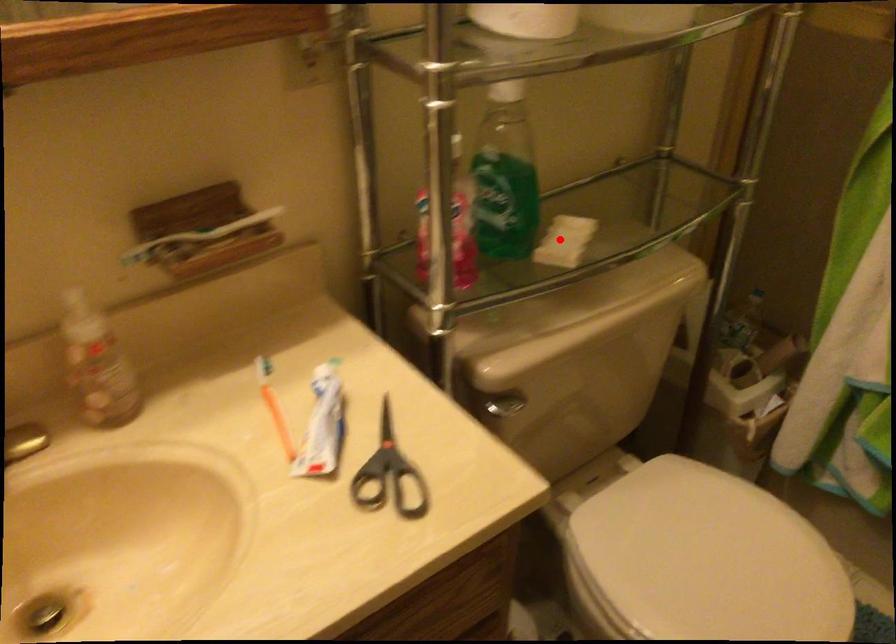
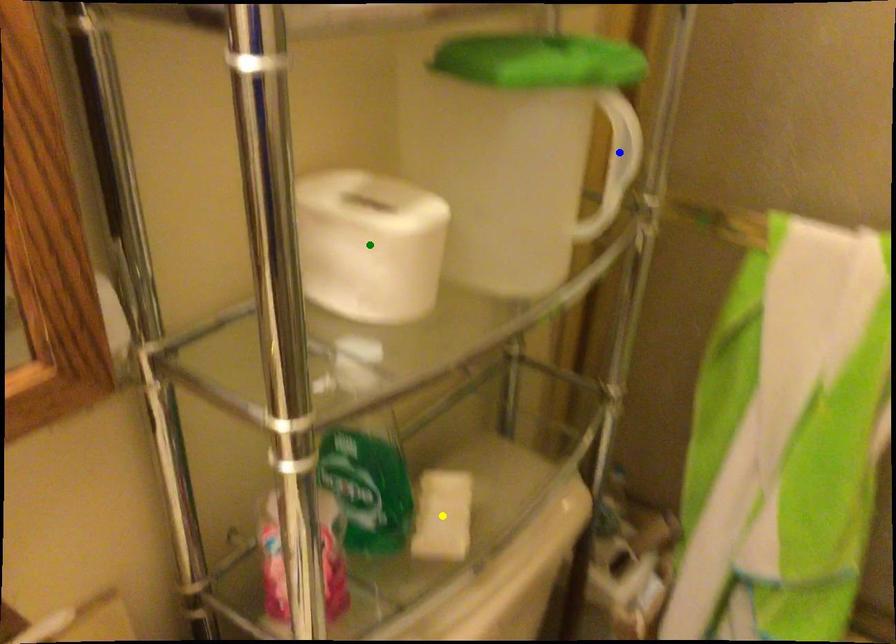
Question: I am providing you with two images of the same scene from different viewpoints. A red point is marked on the first image. You are given multiple points on the second image. In image 2, which mark is for the same physical point as the one in image 1?

Choices:
 (A) green point
 (B) blue point
 (C) yellow point

Answer: (C)